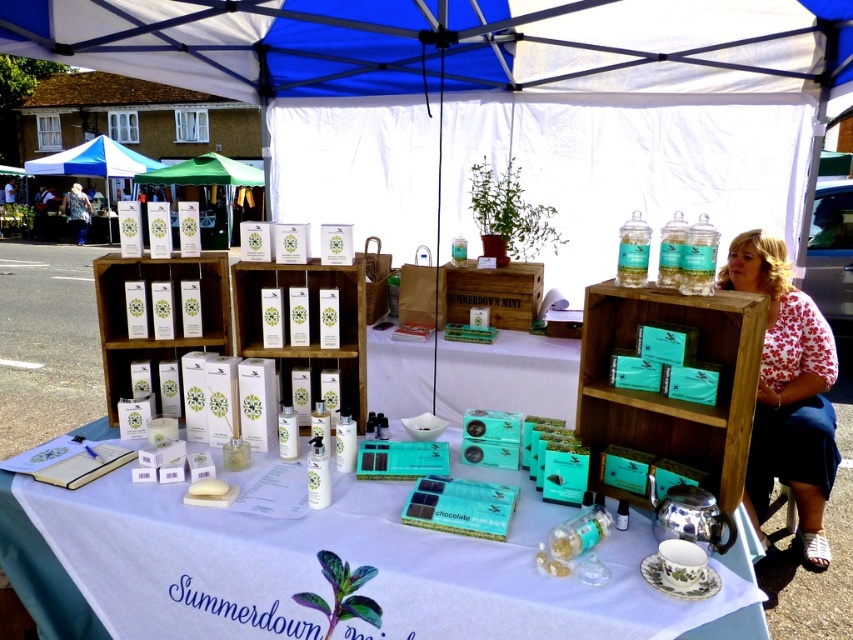
You are a customer at the Summerdown Mint stall and want to place an order. You see the white floral shirt at upper right and the white glossy table at center. Which object is higher up in the image?

The white floral shirt at upper right is above the white glossy table at center, so it is higher up in the image.

Looking at this image, you are a customer at the Summerdown Mint stall and want to know where the blue fabric canopy at upper center is located relative to the white glossy table at center. Could you describe their positions?

The blue fabric canopy at upper center is positioned on the right side of the white glossy table at center.

You are a customer at the Summerdown Mint stall. You want to know if the blue fabric canopy at upper center can provide shade over the white glossy table at center. Based on their heights, can it?

The blue fabric canopy at upper center is taller than the white glossy table at center, so yes, the canopy can provide shade over the white glossy table at center.